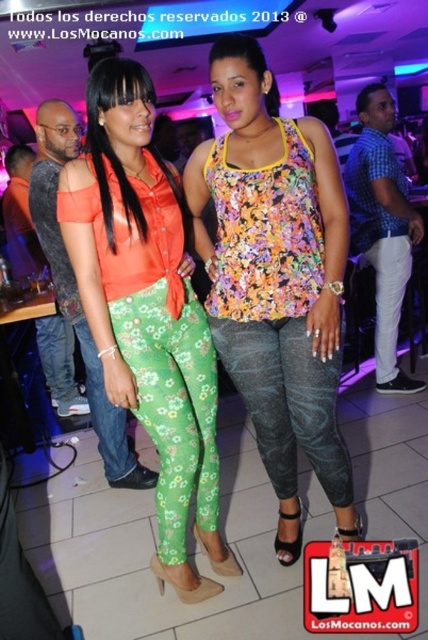
Question: Is floral fabric top at center positioned before green floral pants at center?

Choices:
 (A) no
 (B) yes

Answer: (B)

Question: Which of these objects is positioned closest to the green floral pants at center?

Choices:
 (A) green floral leggings at lower left
 (B) white cotton pants at right
 (C) floral fabric top at center

Answer: (C)

Question: Does white cotton pants at right have a lesser width compared to green floral leggings at lower left?

Choices:
 (A) yes
 (B) no

Answer: (B)

Question: Observing the image, what is the correct spatial positioning of green floral pants at center in reference to metallic textured leggings at center?

Choices:
 (A) right
 (B) left

Answer: (B)

Question: Which point is closer to the camera?

Choices:
 (A) (142, 385)
 (B) (237, 220)

Answer: (B)

Question: Which object appears closest to the camera in this image?

Choices:
 (A) white cotton pants at right
 (B) green floral pants at center
 (C) green floral leggings at lower left
 (D) metallic textured leggings at center

Answer: (B)